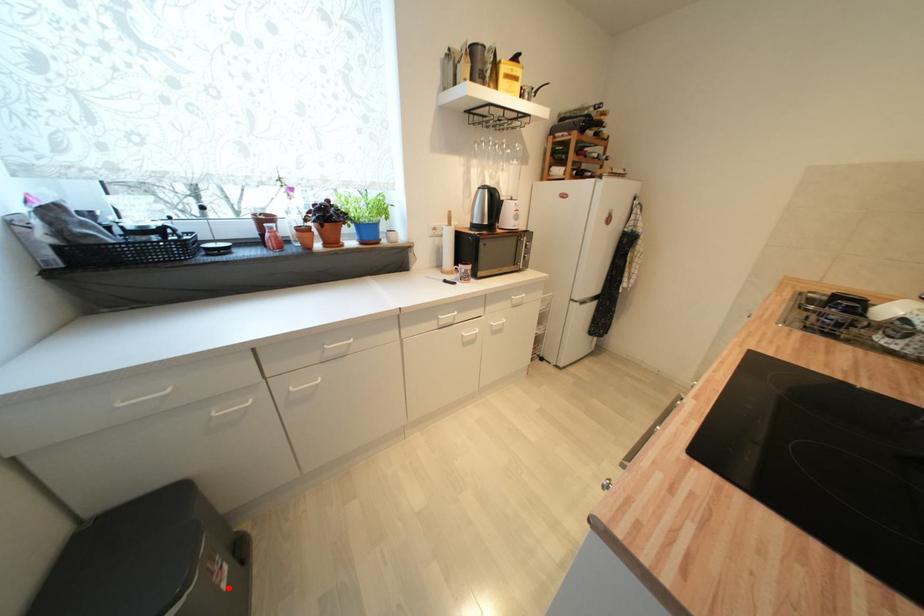
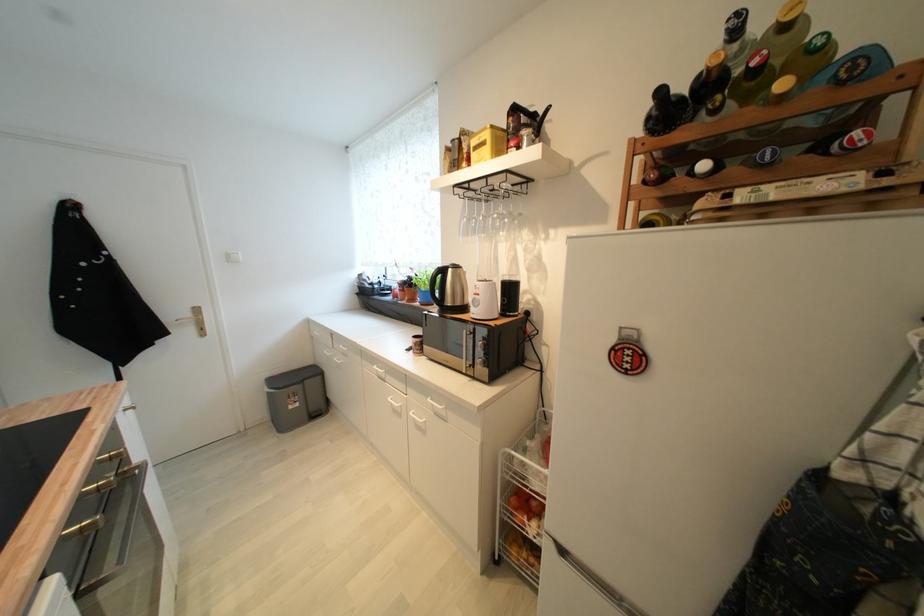
Question: I am providing you with two images of the same scene from different viewpoints. Given a red point in image1, look at the same physical point in image2. Is it:

Choices:
 (A) Closer to the viewpoint
 (B) Farther from the viewpoint

Answer: (A)